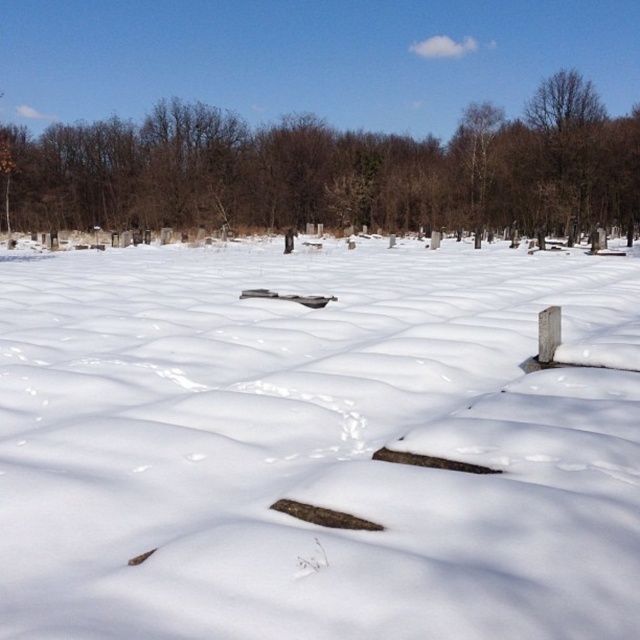
You are standing in the cemetery scene and want to place a small wreath on the brown wood tree at center. However, there is white fluffy snow at center in the way. Which direction should you move the snow to access the tree?

You should move the white fluffy snow at center to the left since it is currently to the right of the brown wood tree at center, so moving it left would clear the path.

You are standing in a winter cemetery and notice the white fluffy snow at center and the brown wood tree at center. Which object takes up more space in the image?

The brown wood tree at center takes up more space in the image because it is larger than the white fluffy snow at center.

You are standing at the edge of a snowy cemetery and see the white fluffy snow at center and the brown wood tree at center. Which object is taller?

The brown wood tree at center is taller than the white fluffy snow at center.